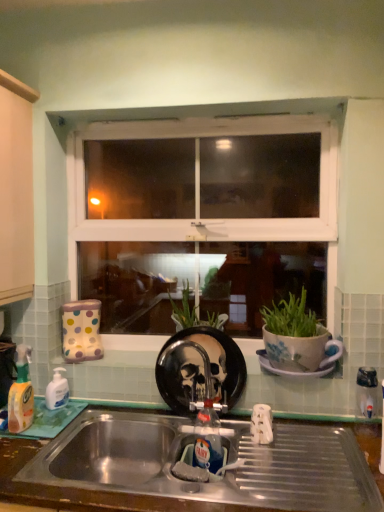
Identify the location of vacant space to the right of translucent plastic bottle at left, the first bottle from the front. This screenshot has height=512, width=384. (48, 426).